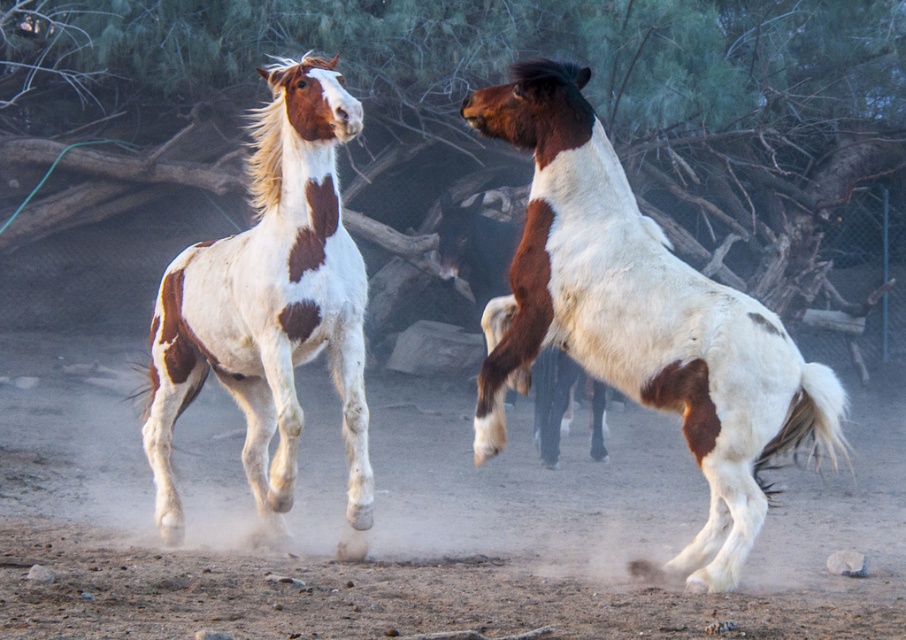
In the scene shown: You are a photographer standing at the camera position. You want to capture a closeup shot of the white speckled horse at left. Given that your camera has a maximum zoom range of 20 feet, can you get a clear closeup without moving closer?

The white speckled horse at left and camera are 23.57 feet apart, which exceeds the camera maximum zoom range of 20 feet. Therefore, you cannot get a clear closeup without moving closer.